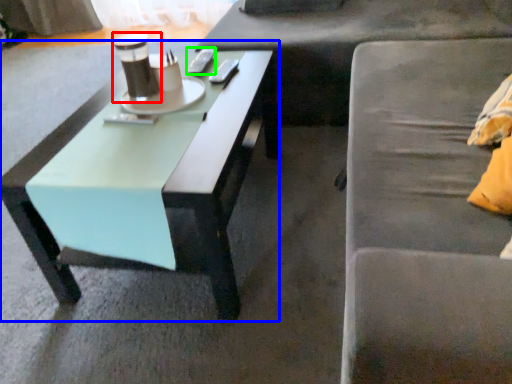
Question: Based on their relative distances, which object is nearer to coffee cup (highlighted by a red box)? Choose from coffee table (highlighted by a blue box) and remote control (highlighted by a green box).

Choices:
 (A) coffee table
 (B) remote control

Answer: (B)